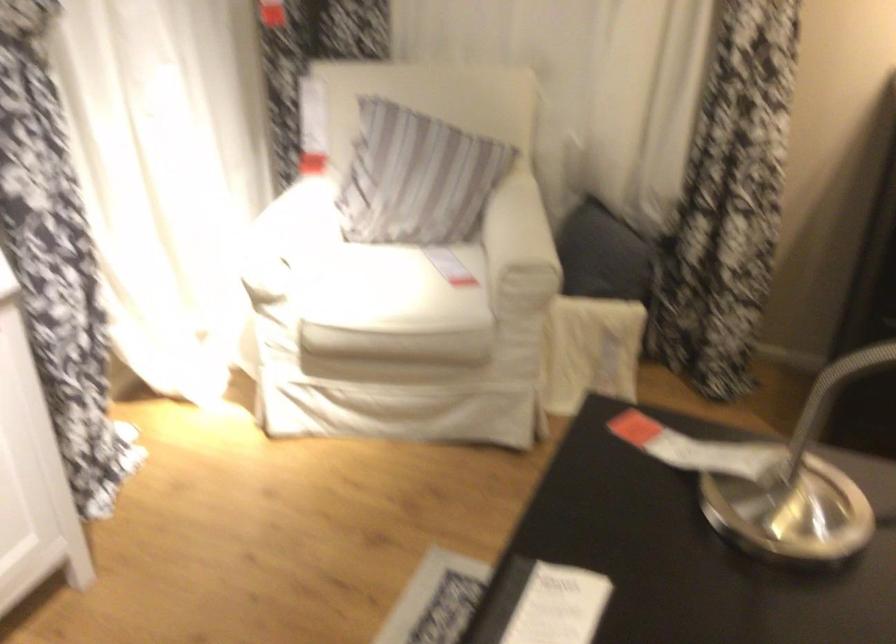
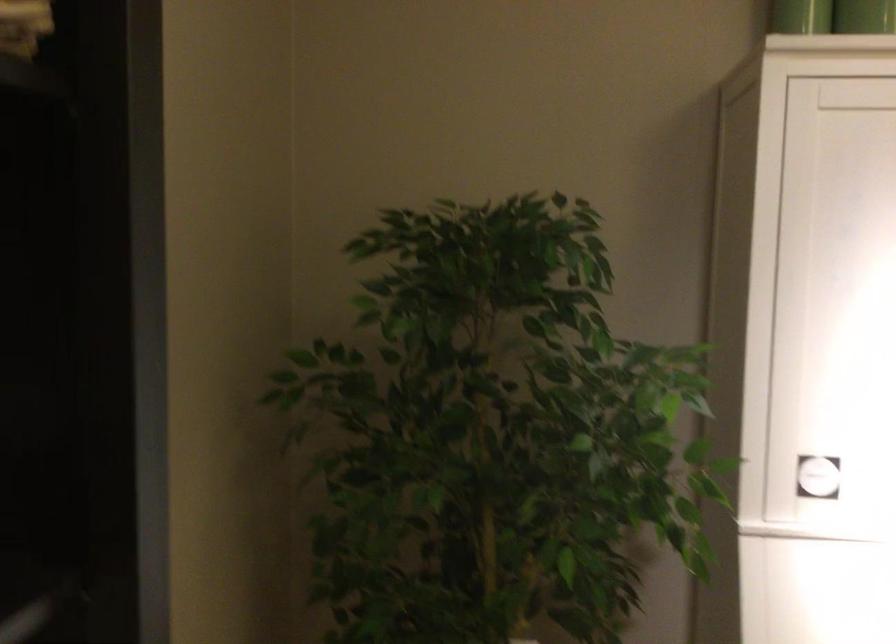
Question: The first image is from the beginning of the video and the second image is from the end. How did the camera likely rotate when shooting the video?

Choices:
 (A) Left
 (B) Right
 (C) Up
 (D) Down

Answer: (A)